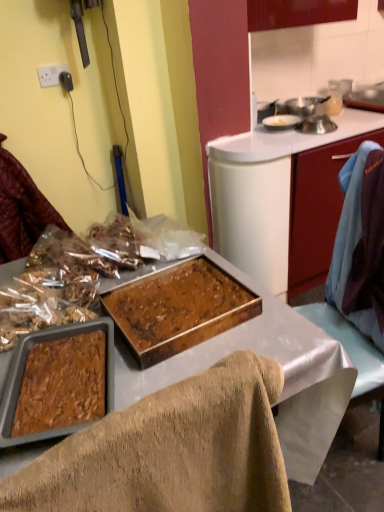
What do you see at coordinates (305, 105) in the screenshot? I see `metallic silver pot at upper right` at bounding box center [305, 105].

What do you see at coordinates (50, 74) in the screenshot? The width and height of the screenshot is (384, 512). I see `white plastic power outlet at upper left` at bounding box center [50, 74].

What do you see at coordinates (317, 210) in the screenshot? The width and height of the screenshot is (384, 512). I see `matte red cabinet at right` at bounding box center [317, 210].

This screenshot has width=384, height=512. I want to click on brown crumbly cake at center, which is counted as the first food, starting from the front, so click(175, 301).

Describe the element at coordinates (175, 301) in the screenshot. I see `brown crumbly cake at center, the second food positioned from the back` at that location.

The height and width of the screenshot is (512, 384). I want to click on brown crumbly mixture at left, arranged as the 1th food when viewed from the back, so click(x=54, y=285).

Which is more to the right, brown crumbly cake at center, which is counted as the first food, starting from the front, or white plastic power outlet at upper left?

brown crumbly cake at center, which is counted as the first food, starting from the front.

Between brown crumbly cake at center, the second food positioned from the back, and white plastic power outlet at upper left, which one has less height?

brown crumbly cake at center, the second food positioned from the back, is shorter.

Would you say brown crumbly cake at center, which is counted as the first food, starting from the front, is outside white plastic power outlet at upper left?

That's correct, brown crumbly cake at center, which is counted as the first food, starting from the front, is outside of white plastic power outlet at upper left.

Is brown crumbly cake at center, the second food positioned from the back, oriented away from white plastic power outlet at upper left?

brown crumbly cake at center, the second food positioned from the back, does not have its back to white plastic power outlet at upper left.

Based on the photo, would you consider white plastic power outlet at upper left to be distant from shiny plastic bag of nuts at left?

Actually, white plastic power outlet at upper left and shiny plastic bag of nuts at left are a little close together.

Find the location of a particular element. power outlet behind the shiny plastic bag of nuts at left is located at coordinates (50, 74).

Is white plastic power outlet at upper left not inside shiny plastic bag of nuts at left?

Yes, white plastic power outlet at upper left is outside of shiny plastic bag of nuts at left.

Is point (51, 70) closer or farther from the camera than point (12, 216)?

Point (51, 70).

Could you tell me if brown crumbly cake at center, which is counted as the first food, starting from the front, is turned towards brown textured tray at center?

No, brown crumbly cake at center, which is counted as the first food, starting from the front, is not facing towards brown textured tray at center.

From a real-world perspective, who is located higher, brown crumbly cake at center, which is counted as the first food, starting from the front, or brown textured tray at center?

brown crumbly cake at center, which is counted as the first food, starting from the front, is physically above.

Identify the location of desk on the left side of brown crumbly cake at center, which is counted as the first food, starting from the front. point(252,348).

Considering the relative sizes of brown crumbly cake at center, which is counted as the first food, starting from the front, and brown textured tray at center in the image provided, is brown crumbly cake at center, which is counted as the first food, starting from the front, bigger than brown textured tray at center?

No, brown crumbly cake at center, which is counted as the first food, starting from the front, is not bigger than brown textured tray at center.

Is matte red cabinet at right turned away from brown crumbly cake at center, which is counted as the first food, starting from the front?

That's not correct — matte red cabinet at right is not looking away from brown crumbly cake at center, which is counted as the first food, starting from the front.

Are matte red cabinet at right and brown crumbly cake at center, which is counted as the first food, starting from the front, beside each other?

No, matte red cabinet at right is not next to brown crumbly cake at center, which is counted as the first food, starting from the front.

The image size is (384, 512). There is a matte red cabinet at right. Identify the location of the 2nd food below it (from the image's perspective). (175, 301).

Can you confirm if matte red cabinet at right is shorter than brown crumbly cake at center, the second food positioned from the back?

No, matte red cabinet at right is not shorter than brown crumbly cake at center, the second food positioned from the back.

Considering the points (46, 86) and (189, 306), which point is behind, point (46, 86) or point (189, 306)?

The point (46, 86) is more distant.

From a real-world perspective, between white plastic power outlet at upper left and brown crumbly cake at center, which is counted as the first food, starting from the front, who is vertically higher?

white plastic power outlet at upper left is physically above.

In the scene shown: Between white plastic power outlet at upper left and brown crumbly cake at center, the second food positioned from the back, which one has less height?

brown crumbly cake at center, the second food positioned from the back, is shorter.

Is white plastic power outlet at upper left wider or thinner than brown crumbly cake at center, the second food positioned from the back?

Considering their sizes, white plastic power outlet at upper left looks slimmer than brown crumbly cake at center, the second food positioned from the back.

What's the angular difference between brown crumbly mixture at left, arranged as the 1th food when viewed from the back, and matte red cabinet at right's facing directions?

The angular difference between brown crumbly mixture at left, arranged as the 1th food when viewed from the back, and matte red cabinet at right is 97.2 degrees.

Which is correct: brown crumbly mixture at left, arranged as the 1th food when viewed from the back, is inside matte red cabinet at right, or outside of it?

brown crumbly mixture at left, arranged as the 1th food when viewed from the back, is not inside matte red cabinet at right, it's outside.

You are a GUI agent. You are given a task and a screenshot of the screen. Output one action in this format:
    pyautogui.click(x=<x>, y=<y>)
    Task: Click on the food that is the 1st one when counting downward from the matte red cabinet at right (from the image's perspective)
    The height and width of the screenshot is (512, 384).
    Given the screenshot: What is the action you would take?
    pyautogui.click(x=54, y=285)

Considering the points (55, 316) and (315, 231), which point is in front, point (55, 316) or point (315, 231)?

The point (55, 316) is closer.

Is the depth of brown crumbly cake at center, which is counted as the first food, starting from the front, greater than that of matte red cabinet at right?

That is False.

Does point (185, 264) lie behind point (365, 134)?

No.

Is brown crumbly cake at center, the second food positioned from the back, at the left side of matte red cabinet at right?

Yes, brown crumbly cake at center, the second food positioned from the back, is to the left of matte red cabinet at right.

The height and width of the screenshot is (512, 384). I want to click on the 2nd food below the white plastic power outlet at upper left (from a real-world perspective), so click(175, 301).

The width and height of the screenshot is (384, 512). What are the coordinates of `leftover in front of the white plastic power outlet at upper left` in the screenshot? It's located at (21, 209).

From the image, which object appears to be nearer to shiny plastic bag of nuts at left, brown textured tray at center or matte red cabinet at right?

brown textured tray at center is closer to shiny plastic bag of nuts at left.

Which object lies nearer to the anchor point metallic silver pot at upper right, white plastic power outlet at upper left or brown textured tray at center?

The object closer to metallic silver pot at upper right is white plastic power outlet at upper left.

Based on their spatial positions, is brown crumbly mixture at left, the 2th food in the front-to-back sequence, or matte red cabinet at right closer to metallic silver pot at upper right?

The object closer to metallic silver pot at upper right is matte red cabinet at right.

When comparing their distances from metallic silver pot at upper right, does shiny plastic bag of nuts at left or brown crumbly cake at center, the second food positioned from the back, seem further?

brown crumbly cake at center, the second food positioned from the back, is positioned further to the anchor metallic silver pot at upper right.

When comparing their distances from metallic silver pot at upper right, does brown crumbly mixture at left, the 2th food in the front-to-back sequence, or brown crumbly cake at center, which is counted as the first food, starting from the front, seem further?

brown crumbly mixture at left, the 2th food in the front-to-back sequence, is further to metallic silver pot at upper right.

From the image, which object appears to be nearer to matte red cabinet at right, brown crumbly cake at center, which is counted as the first food, starting from the front, or metallic silver pot at upper right?

Among the two, metallic silver pot at upper right is located nearer to matte red cabinet at right.

Which object lies nearer to the anchor point metallic silver pot at upper right, white plastic power outlet at upper left or brown crumbly cake at center, the second food positioned from the back?

white plastic power outlet at upper left is positioned closer to the anchor metallic silver pot at upper right.

From the image, which object appears to be farther from brown textured tray at center, shiny plastic bag of nuts at left or metallic silver pot at upper right?

The object further to brown textured tray at center is metallic silver pot at upper right.

This screenshot has width=384, height=512. I want to click on cabinetry between white plastic power outlet at upper left and metallic silver pot at upper right from left to right, so click(x=317, y=210).

At what (x,y) coordinates should I click in order to perform the action: click on leftover between brown crumbly cake at center, which is counted as the first food, starting from the front, and white plastic power outlet at upper left in the front-back direction. Please return your answer as a coordinate pair (x, y). This screenshot has width=384, height=512. Looking at the image, I should click on (21, 209).

Identify the location of food located between brown textured tray at center and matte red cabinet at right in the left-right direction. The height and width of the screenshot is (512, 384). (175, 301).

Where is `desk situated between shiny plastic bag of nuts at left and matte red cabinet at right from left to right`? desk situated between shiny plastic bag of nuts at left and matte red cabinet at right from left to right is located at coordinates (252, 348).